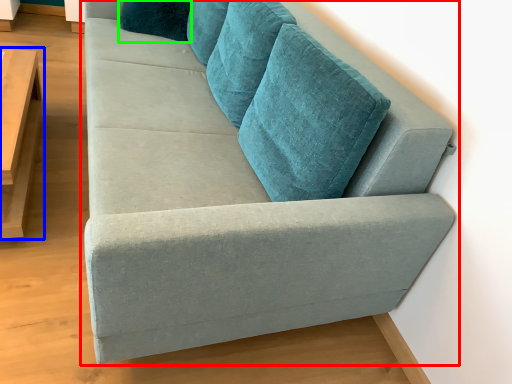
Question: Which is nearer to the studio couch (highlighted by a red box)? table (highlighted by a blue box) or pillow (highlighted by a green box).

Choices:
 (A) table
 (B) pillow

Answer: (A)